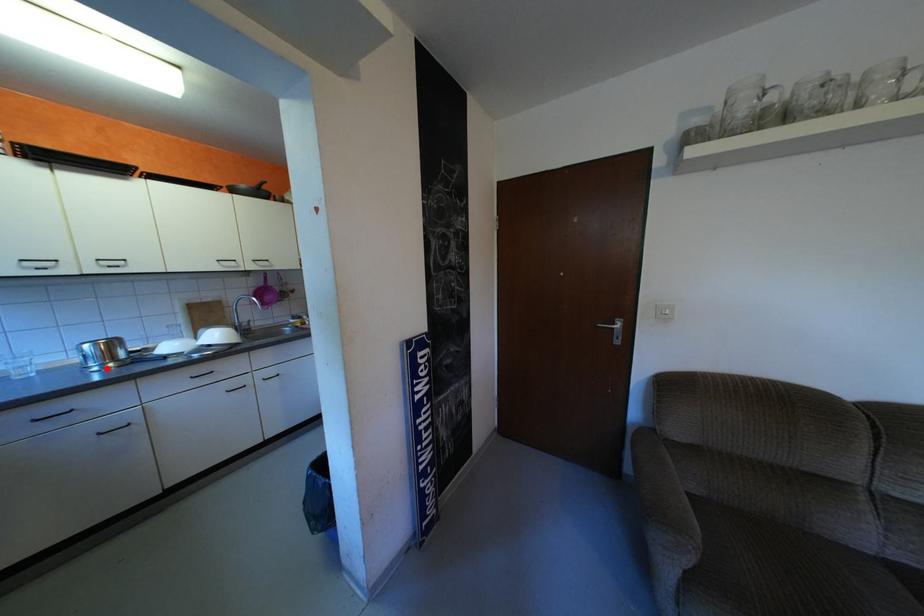
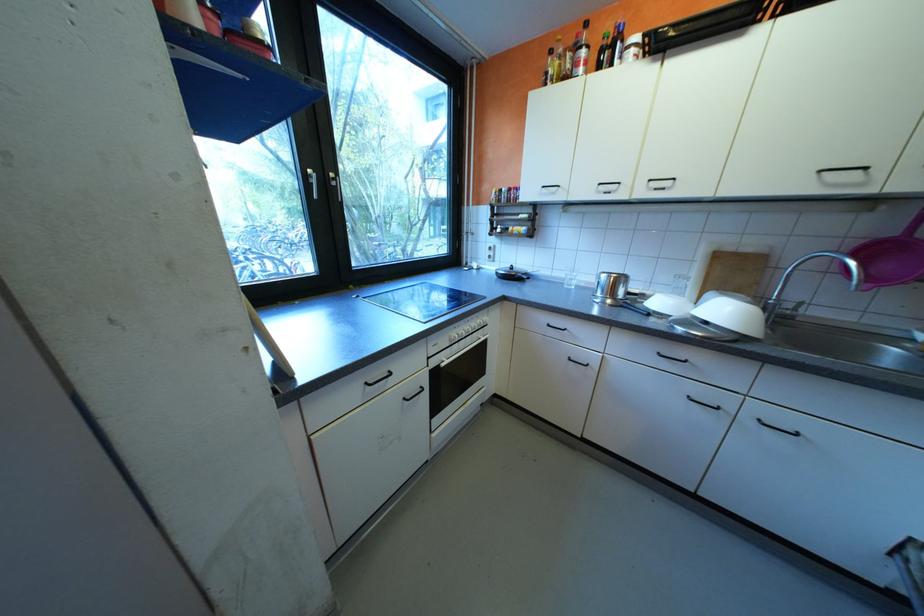
Find the pixel in the second image that matches the highlighted location in the first image.

(608, 300)